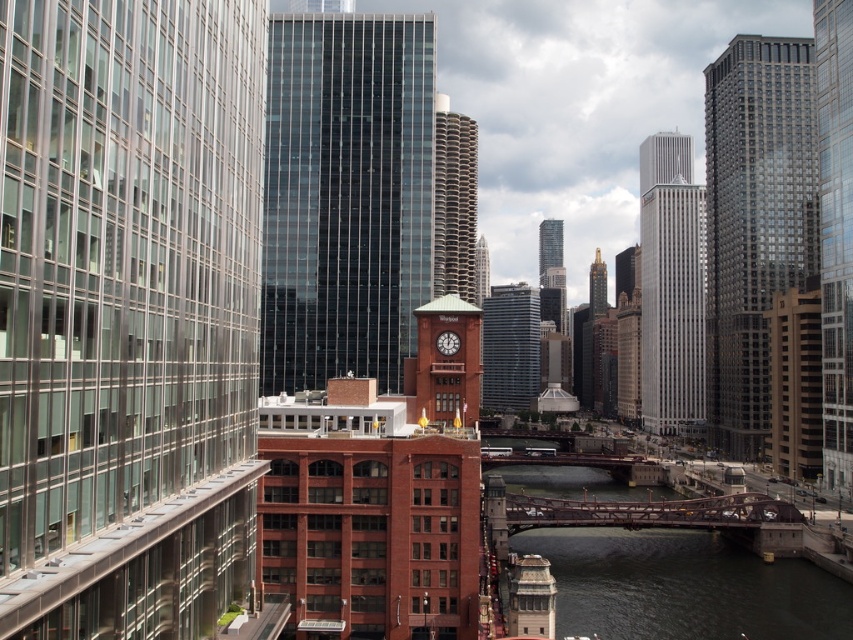
You are standing at the base of the red brick building with the clock tower. You want to walk directly to the glassy gray skyscraper at right. How far will you have to walk in meters?

The glassy gray skyscraper at right is 159.81 meters from viewer, so you will have to walk 159.81 meters to reach it.